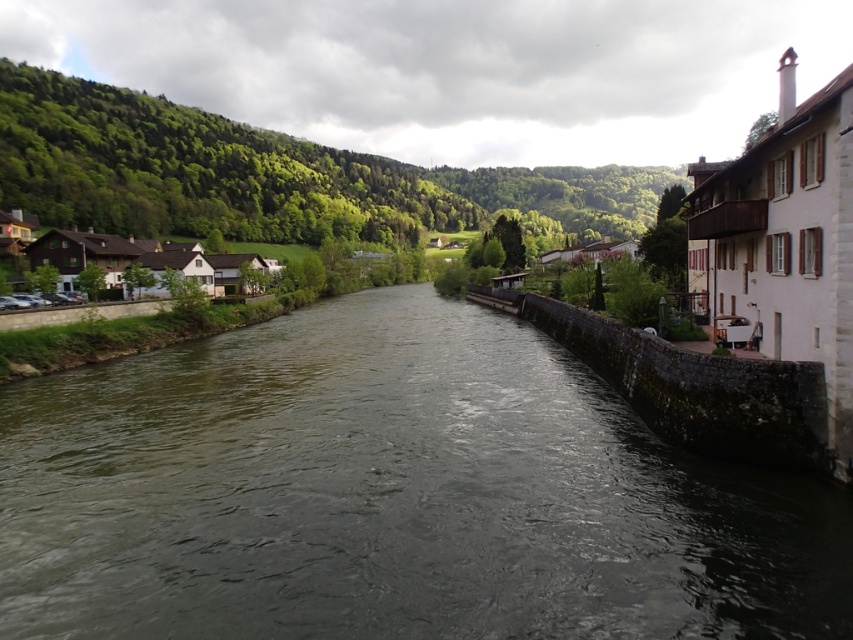
Question: Is dark gray concrete stream at center to the left of white stone houses at left from the viewer's perspective?

Choices:
 (A) no
 (B) yes

Answer: (A)

Question: Which point is closer to the camera taking this photo?

Choices:
 (A) (109, 260)
 (B) (474, 472)

Answer: (B)

Question: Which point is farther from the camera taking this photo?

Choices:
 (A) (154, 257)
 (B) (486, 509)

Answer: (A)

Question: Is dark gray concrete stream at center bigger than white stone houses at left?

Choices:
 (A) no
 (B) yes

Answer: (A)

Question: Among these objects, which one is nearest to the camera?

Choices:
 (A) dark gray concrete stream at center
 (B) white stone houses at left

Answer: (A)

Question: Can you confirm if dark gray concrete stream at center is positioned above white stone houses at left?

Choices:
 (A) yes
 (B) no

Answer: (B)